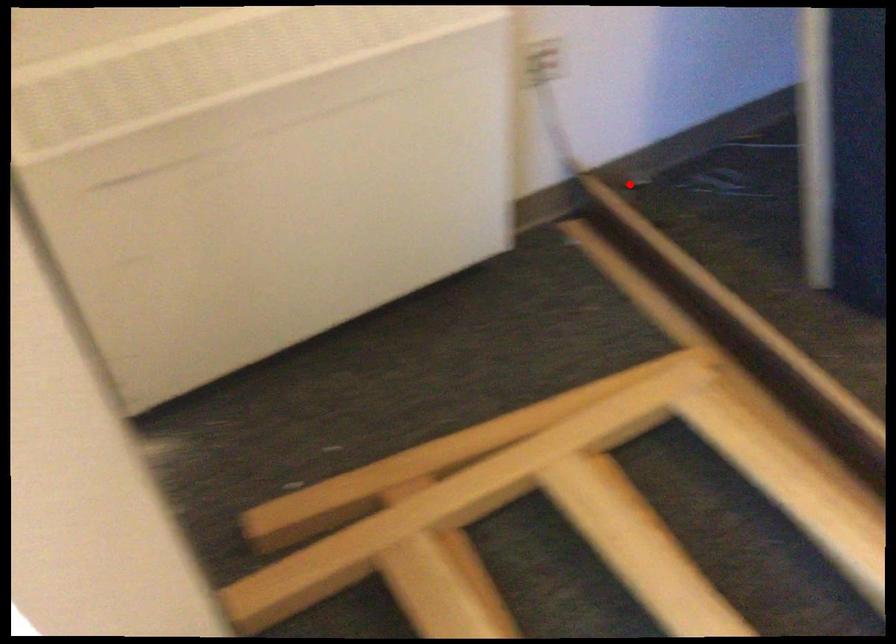
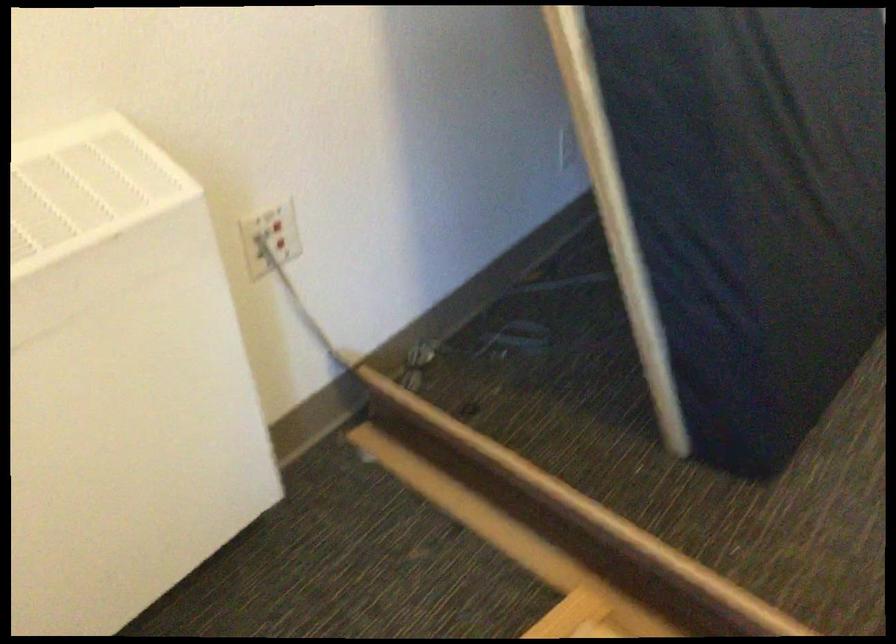
Question: I am providing you with two images of the same scene from different viewpoints. Given a red point in image1, look at the same physical point in image2. Is it:

Choices:
 (A) Closer to the viewpoint
 (B) Farther from the viewpoint

Answer: (A)